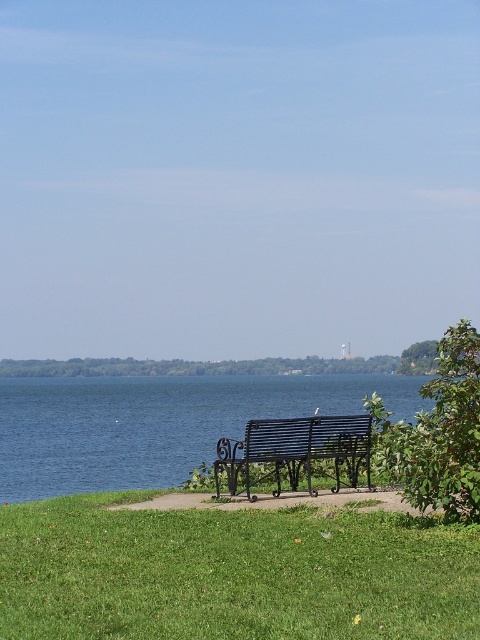
Question: Which point is farther from the camera taking this photo?

Choices:
 (A) (154, 502)
 (B) (218, 445)
 (C) (142, 609)

Answer: (A)

Question: Which point is farther to the camera?

Choices:
 (A) [204, 496]
 (B) [219, 433]

Answer: (B)

Question: Can you confirm if blue metallic lake at center is bigger than metallic black bench at center?

Choices:
 (A) yes
 (B) no

Answer: (A)

Question: Observing the image, what is the correct spatial positioning of black wrought iron bench at center in reference to metallic black bench at center?

Choices:
 (A) above
 (B) below

Answer: (A)

Question: Can you confirm if green grass at lower center is smaller than blue metallic lake at center?

Choices:
 (A) no
 (B) yes

Answer: (B)

Question: Among these points, which one is nearest to the camera?

Choices:
 (A) (369, 449)
 (B) (472, 630)
 (C) (121, 458)
 (D) (288, 496)

Answer: (B)